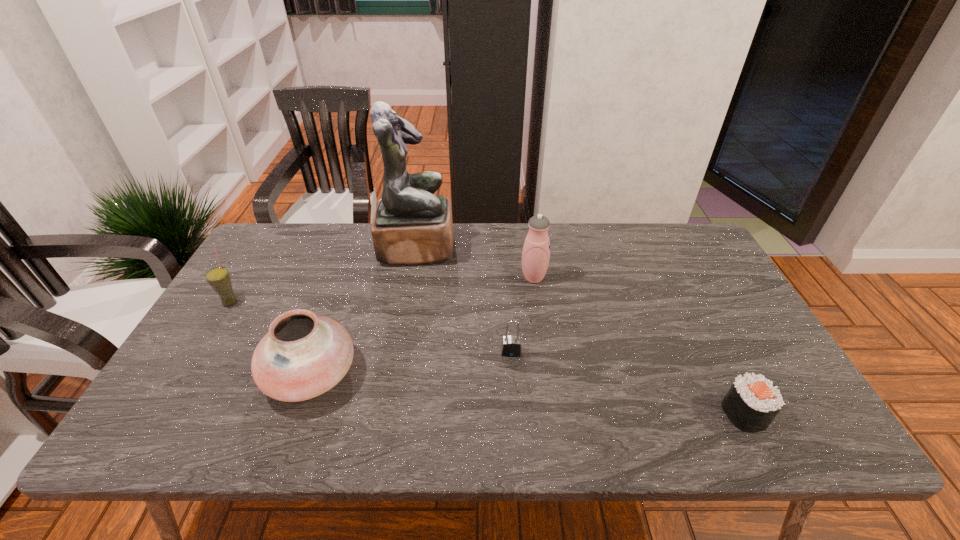
Where is `object positioned at the left edge`? This screenshot has height=540, width=960. object positioned at the left edge is located at coordinates (219, 279).

In order to click on object that is at the right edge in this screenshot , I will do `click(752, 402)`.

The width and height of the screenshot is (960, 540). What are the coordinates of `object that is at the near right corner` in the screenshot? It's located at (752, 402).

Image resolution: width=960 pixels, height=540 pixels. Find the location of `vacant space at the far edge of the desktop`. vacant space at the far edge of the desktop is located at coordinates (621, 240).

This screenshot has width=960, height=540. I want to click on free location at the near edge, so click(575, 411).

This screenshot has width=960, height=540. In the image, there is a desktop. Find the location of `blank space at the left edge`. blank space at the left edge is located at coordinates (284, 287).

Locate an element on the screen. vacant position at the far right corner of the desktop is located at coordinates (664, 227).

I want to click on free space that is in between the tallest object and the shortest object, so click(x=581, y=330).

Where is `vacant point located between the farthest object and the sushi`? vacant point located between the farthest object and the sushi is located at coordinates (581, 330).

The image size is (960, 540). I want to click on free spot between the shortest object and the tallest object, so click(581, 330).